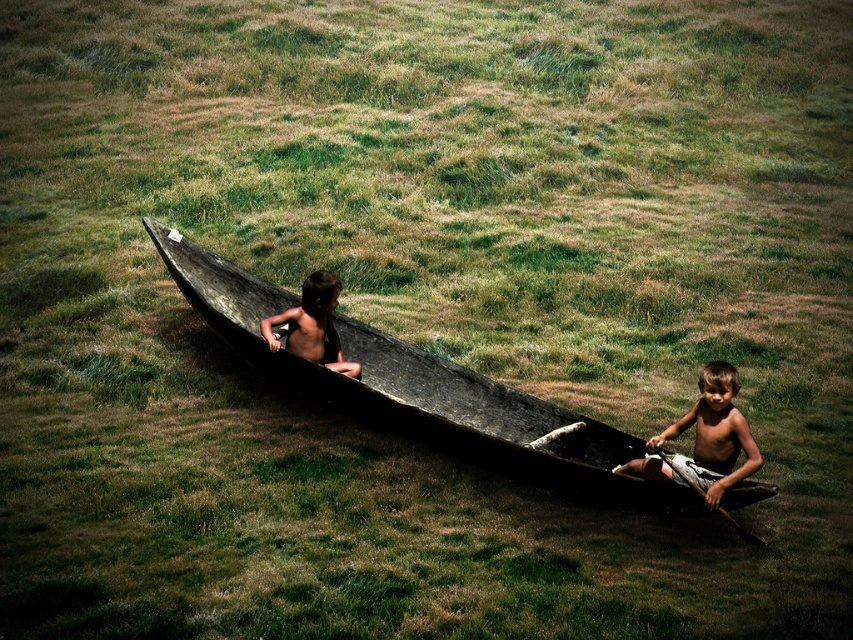
Is point (653, 468) positioned before point (660, 451)?

Yes.

Which is behind, point (625, 468) or point (671, 461)?

Point (625, 468)

Find the location of a particular element. The width and height of the screenshot is (853, 640). light brown wooden boat at lower right is located at coordinates (714, 435).

The image size is (853, 640). I want to click on light brown wooden boat at lower right, so click(x=714, y=435).

Is the position of dark wood canoe at center less distant than that of light brown wooden boat at lower right?

No, dark wood canoe at center is further to the viewer.

Image resolution: width=853 pixels, height=640 pixels. What do you see at coordinates (418, 385) in the screenshot?
I see `dark wood canoe at center` at bounding box center [418, 385].

Does point (659, 499) come farther from viewer compared to point (630, 472)?

No, (659, 499) is closer to viewer.

Identify the location of dark wood canoe at center. This screenshot has width=853, height=640. (418, 385).

Does shiny brown hair at center appear on the right side of wooden smooth paddle at lower right?

In fact, shiny brown hair at center is to the left of wooden smooth paddle at lower right.

Who is taller, shiny brown hair at center or wooden smooth paddle at lower right?

shiny brown hair at center is taller.

Is point (311, 356) farther from camera compared to point (660, 458)?

Yes.

At what (x,y) coordinates should I click in order to perform the action: click on shiny brown hair at center. Please return your answer as a coordinate pair (x, y). Looking at the image, I should click on (312, 324).